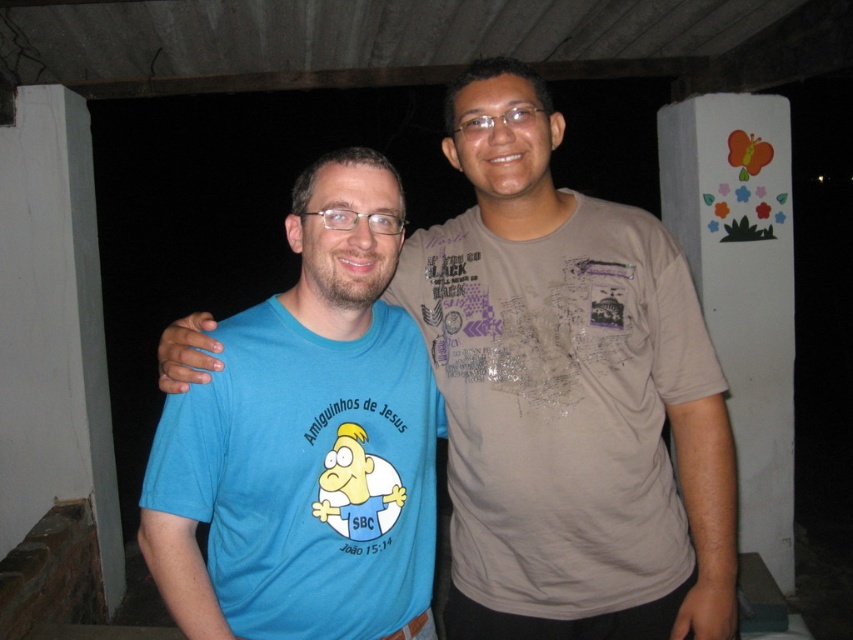
Question: Which point is farther to the camera?

Choices:
 (A) (747, 467)
 (B) (474, 70)
 (C) (339, 476)

Answer: (A)

Question: Can you confirm if blue cotton shirt at center is positioned to the left of matte blue t-shirt at center?

Choices:
 (A) no
 (B) yes

Answer: (A)

Question: Among these points, which one is nearest to the camera?

Choices:
 (A) (538, 408)
 (B) (773, 99)
 (C) (178, 419)

Answer: (C)

Question: Which object is closer to the camera taking this photo?

Choices:
 (A) blue cotton shirt at center
 (B) white painted pillar at right
 (C) matte blue t-shirt at center
 (D) matte brown t-shirt at center

Answer: (C)

Question: Does matte blue t-shirt at center come behind white painted pillar at right?

Choices:
 (A) no
 (B) yes

Answer: (A)

Question: Is matte brown t-shirt at center bigger than white painted pillar at right?

Choices:
 (A) no
 (B) yes

Answer: (A)